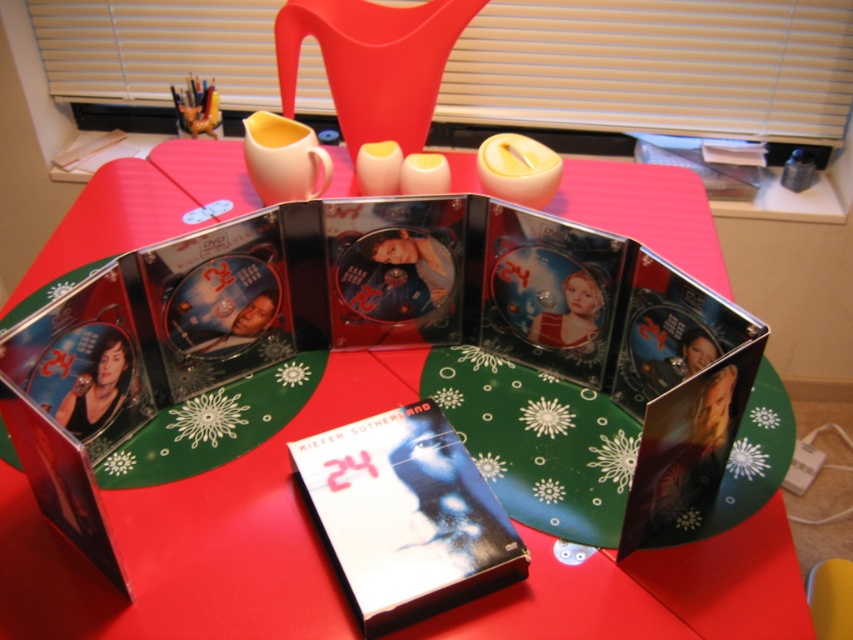
Question: Does red glossy table at center have a larger size compared to matte black dvd at center?

Choices:
 (A) no
 (B) yes

Answer: (B)

Question: Among these objects, which one is farthest from the camera?

Choices:
 (A) red glossy table at center
 (B) matte black dvd at center

Answer: (A)

Question: Is red glossy table at center thinner than matte black dvd at center?

Choices:
 (A) no
 (B) yes

Answer: (A)

Question: Can you confirm if red glossy table at center is bigger than matte black dvd at center?

Choices:
 (A) no
 (B) yes

Answer: (B)